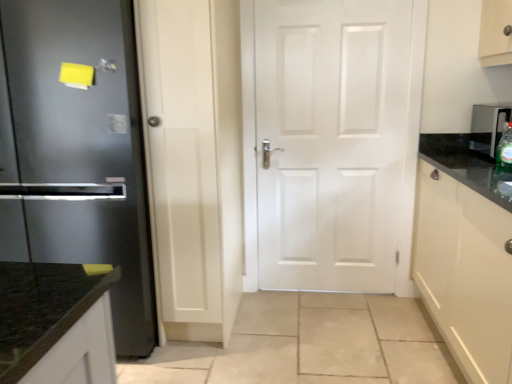
Question: Does white matte door at center appear on the right side of glossy white cabinet at right?

Choices:
 (A) no
 (B) yes

Answer: (A)

Question: From a real-world perspective, is white matte door at center physically below glossy white cabinet at right?

Choices:
 (A) yes
 (B) no

Answer: (B)

Question: Considering the relative sizes of white matte door at center and glossy white cabinet at right in the image provided, is white matte door at center shorter than glossy white cabinet at right?

Choices:
 (A) yes
 (B) no

Answer: (B)

Question: Is white matte door at center turned away from glossy white cabinet at right?

Choices:
 (A) no
 (B) yes

Answer: (A)

Question: Is white matte door at center not within glossy white cabinet at right?

Choices:
 (A) no
 (B) yes

Answer: (B)

Question: From the image's perspective, does white matte door at center appear lower than glossy white cabinet at right?

Choices:
 (A) no
 (B) yes

Answer: (A)

Question: Considering the relative sizes of metallic silver water dispenser at right and green glass bottle at right in the image provided, is metallic silver water dispenser at right shorter than green glass bottle at right?

Choices:
 (A) yes
 (B) no

Answer: (B)

Question: Can green glass bottle at right be found inside metallic silver water dispenser at right?

Choices:
 (A) no
 (B) yes

Answer: (A)

Question: From the image's perspective, is metallic silver water dispenser at right on top of green glass bottle at right?

Choices:
 (A) yes
 (B) no

Answer: (A)

Question: Does metallic silver water dispenser at right have a greater width compared to green glass bottle at right?

Choices:
 (A) yes
 (B) no

Answer: (A)

Question: Is metallic silver water dispenser at right smaller than green glass bottle at right?

Choices:
 (A) no
 (B) yes

Answer: (A)

Question: From the image's perspective, does metallic silver water dispenser at right appear lower than green glass bottle at right?

Choices:
 (A) yes
 (B) no

Answer: (B)

Question: From the image's perspective, does white matte door at center appear lower than green glass bottle at right?

Choices:
 (A) no
 (B) yes

Answer: (A)